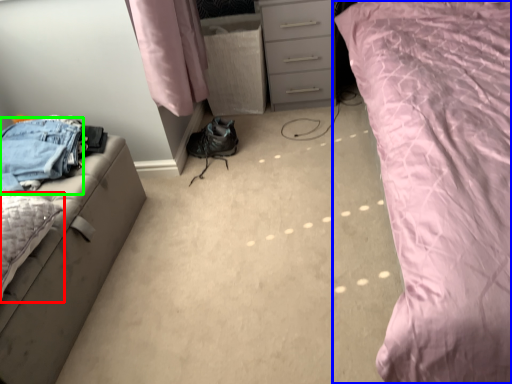
Question: Based on their relative distances, which object is nearer to pillow (highlighted by a red box)? Choose from bed (highlighted by a blue box) and trousers (highlighted by a green box).

Choices:
 (A) bed
 (B) trousers

Answer: (B)